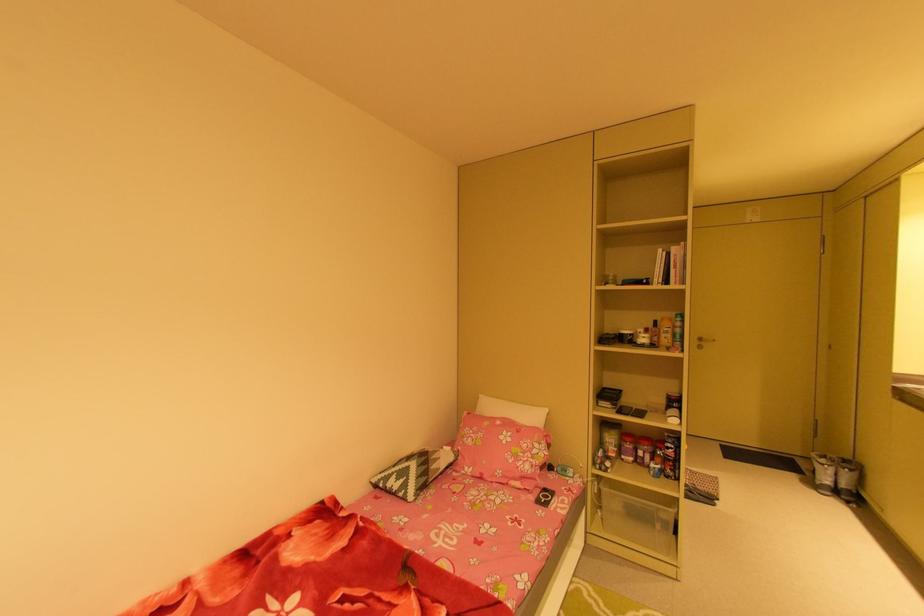
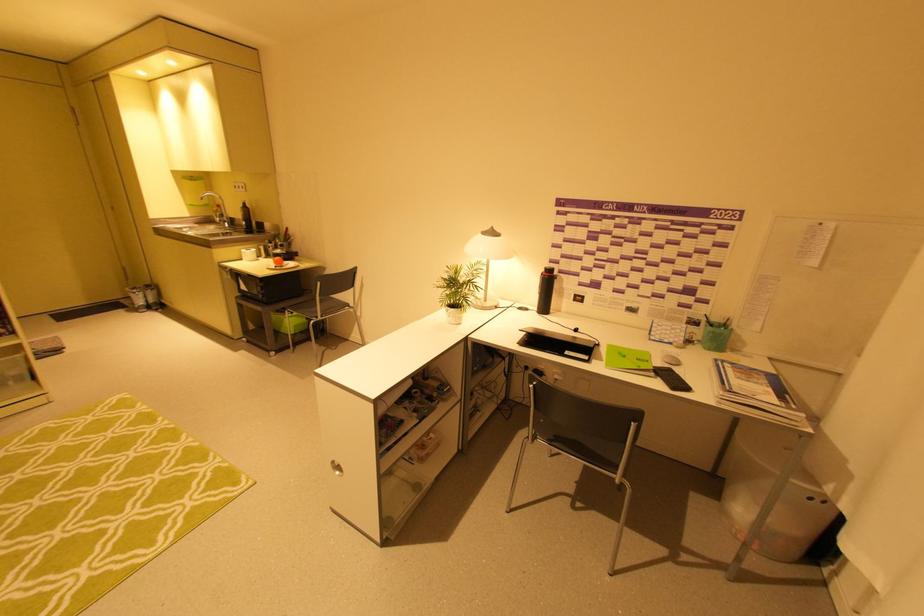
Find the pixel in the second image that matches (831,469) in the first image.

(142, 296)